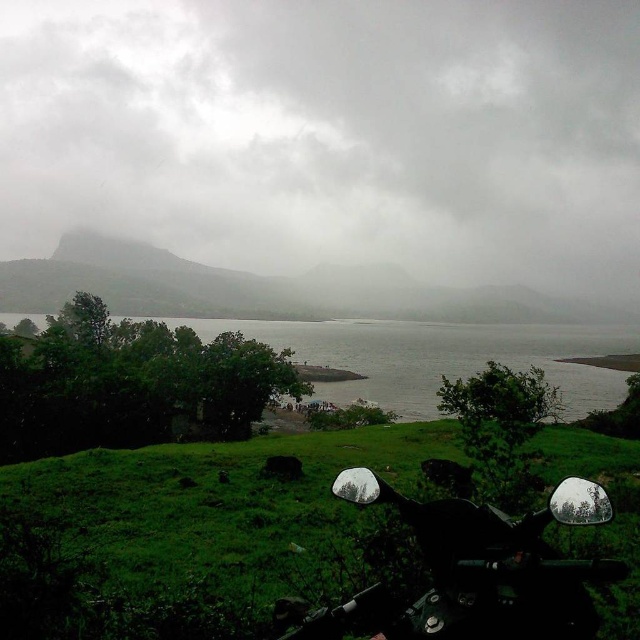
This screenshot has width=640, height=640. What are the coordinates of `cloudy fog at upper center` in the screenshot? It's located at (332, 134).

Is point (448, 273) closer to viewer compared to point (22, 282)?

Yes, it is.

Is point (451, 154) less distant than point (51, 260)?

No, (451, 154) is further to viewer.

Find the location of a particular element. cloudy fog at upper center is located at coordinates (332, 134).

Does cloudy fog at upper center appear on the right side of glossy black motorcycle at lower center?

Incorrect, cloudy fog at upper center is not on the right side of glossy black motorcycle at lower center.

Where is `cloudy fog at upper center`? cloudy fog at upper center is located at coordinates pyautogui.click(x=332, y=134).

The image size is (640, 640). I want to click on cloudy fog at upper center, so click(x=332, y=134).

You are a GUI agent. You are given a task and a screenshot of the screen. Output one action in this format:
    pyautogui.click(x=<x>, y=<y>)
    Task: Click on the cloudy fog at upper center
    
    Given the screenshot: What is the action you would take?
    pyautogui.click(x=332, y=134)

Which is more to the left, green grassy at lower center or glossy black motorcycle at lower center?

glossy black motorcycle at lower center

The height and width of the screenshot is (640, 640). What do you see at coordinates (241, 512) in the screenshot? I see `green grassy at lower center` at bounding box center [241, 512].

Locate an element on the screen. This screenshot has height=640, width=640. green grassy at lower center is located at coordinates (241, 512).

Identify the location of green grassy at lower center. (241, 512).